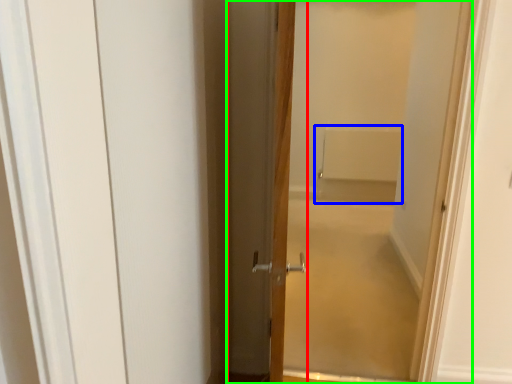
Question: Which object is positioned farthest from door (highlighted by a red box)? Select from bath (highlighted by a blue box) and door (highlighted by a green box).

Choices:
 (A) bath
 (B) door

Answer: (A)